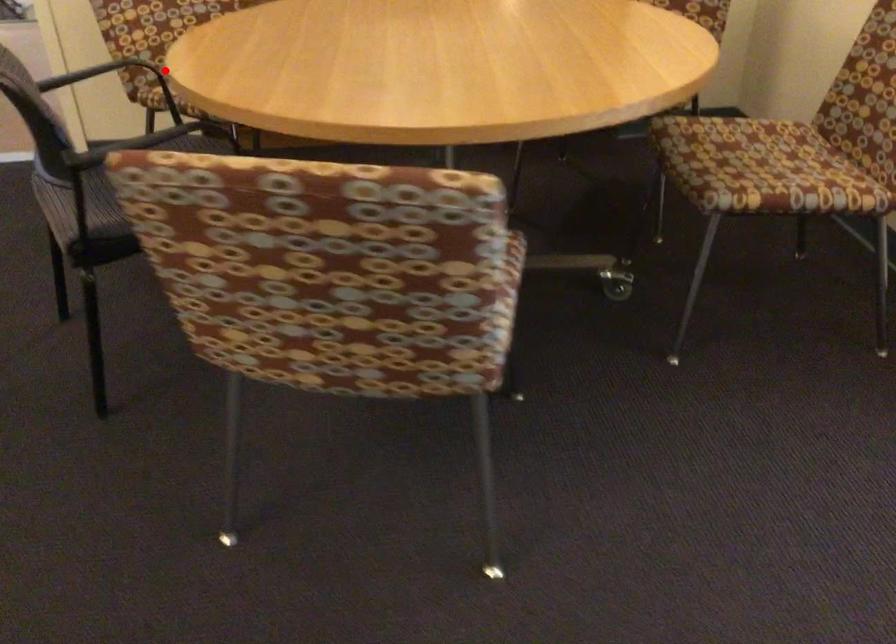
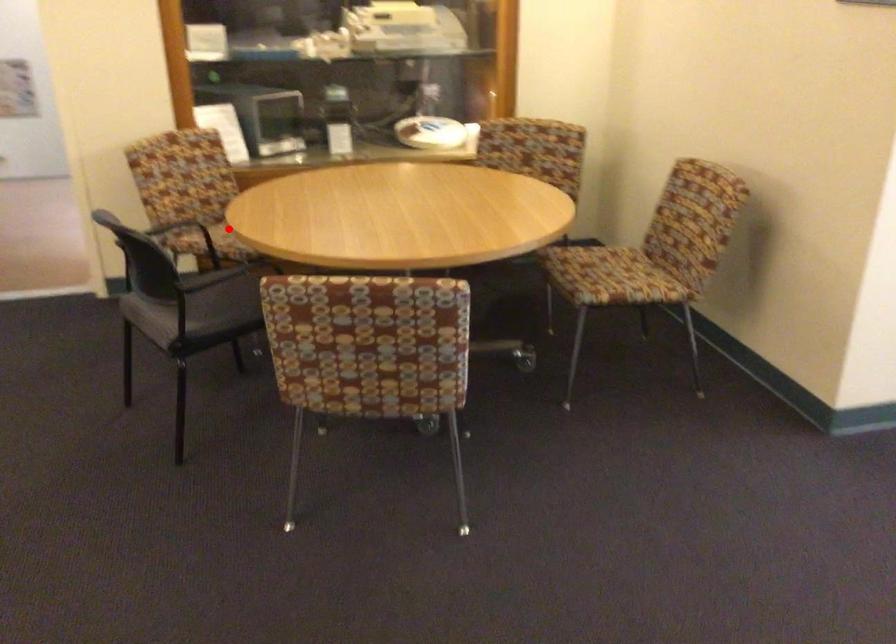
I am providing you with two images of the same scene from different viewpoints. A red point is marked on the first image and another point is marked on the second image. Is the marked point in image1 the same physical position as the marked point in image2?

Yes